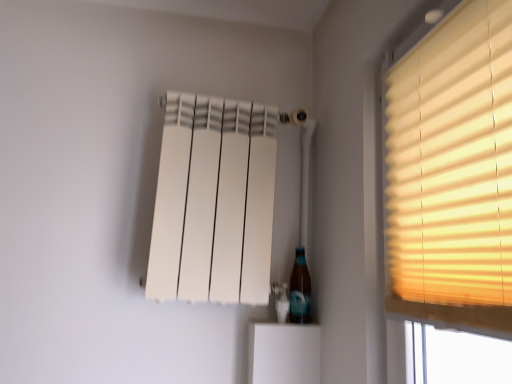
Question: From a real-world perspective, is translucent glass bottle at lower right physically below matte yellow blinds at right?

Choices:
 (A) yes
 (B) no

Answer: (A)

Question: Is translucent glass bottle at lower right completely or partially outside of matte yellow blinds at right?

Choices:
 (A) no
 (B) yes

Answer: (B)

Question: Is translucent glass bottle at lower right in front of matte yellow blinds at right?

Choices:
 (A) no
 (B) yes

Answer: (A)

Question: From the image's perspective, is translucent glass bottle at lower right located beneath matte yellow blinds at right?

Choices:
 (A) no
 (B) yes

Answer: (B)

Question: Would you say translucent glass bottle at lower right contains matte yellow blinds at right?

Choices:
 (A) yes
 (B) no

Answer: (B)

Question: Considering the positions of white matte radiator at upper center and matte yellow blinds at right in the image, is white matte radiator at upper center bigger or smaller than matte yellow blinds at right?

Choices:
 (A) small
 (B) big

Answer: (B)

Question: Is white matte radiator at upper center taller or shorter than matte yellow blinds at right?

Choices:
 (A) tall
 (B) short

Answer: (A)

Question: Based on their positions, is white matte radiator at upper center located to the left or right of matte yellow blinds at right?

Choices:
 (A) right
 (B) left

Answer: (B)

Question: Is white matte radiator at upper center inside or outside of matte yellow blinds at right?

Choices:
 (A) inside
 (B) outside

Answer: (B)

Question: From a real-world perspective, relative to matte yellow blinds at right, is translucent glass bottle at lower right vertically above or below?

Choices:
 (A) above
 (B) below

Answer: (B)

Question: Based on their positions, is translucent glass bottle at lower right located to the left or right of matte yellow blinds at right?

Choices:
 (A) left
 (B) right

Answer: (A)

Question: Considering their positions, is translucent glass bottle at lower right located in front of or behind matte yellow blinds at right?

Choices:
 (A) behind
 (B) front

Answer: (A)

Question: Is point (296, 264) positioned closer to the camera than point (467, 241)?

Choices:
 (A) farther
 (B) closer

Answer: (A)

Question: Do you think translucent glass bottle at lower right is within white matte radiator at upper center, or outside of it?

Choices:
 (A) inside
 (B) outside

Answer: (A)

Question: Looking at the image, does translucent glass bottle at lower right seem bigger or smaller compared to white matte radiator at upper center?

Choices:
 (A) big
 (B) small

Answer: (B)